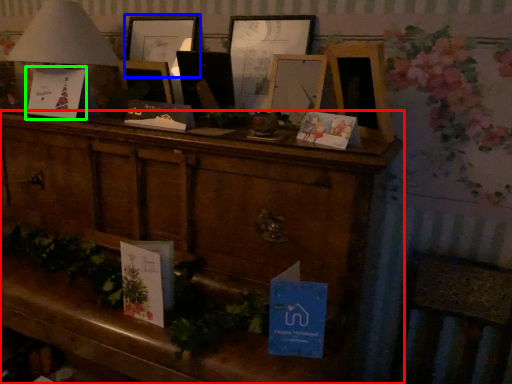
Question: Which object is positioned closest to furniture (highlighted by a red box)? Select from picture frame (highlighted by a blue box) and christmas card (highlighted by a green box).

Choices:
 (A) picture frame
 (B) christmas card

Answer: (B)